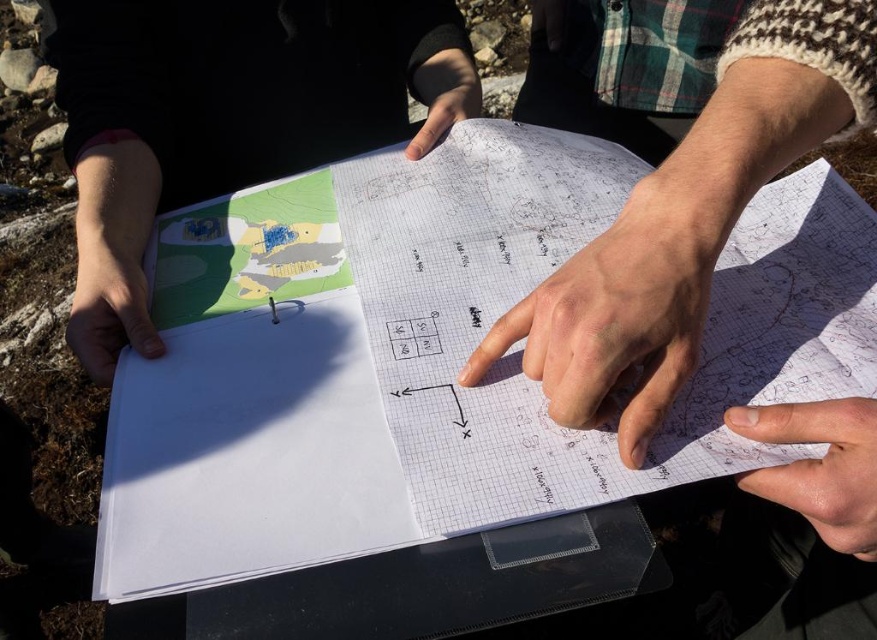
You are an architect reviewing a project layout. You need to determine if the matte paper map at upper left can be placed on a shelf designed for items no wider than the matte white paper at lower left. Can it fit?

The matte paper map at upper left might be wider than the matte white paper at lower left, so it may not fit on the shelf designed for items no wider than the matte white paper at lower left.

You are a field researcher who needs to compare the two papers. You have a magnifying glass that can only focus on objects closer to you. Which paper should you use it on, the matte paper map at upper left or the matte white paper at lower left?

The matte paper map at upper left is closer to the viewer than the matte white paper at lower left, so you should use the magnifying glass on the matte paper map at upper left.

You are a delivery person who needs to place a 18 inch long package on the table between the matte paper map at upper left and the smooth skin hand at lower right. Can the package fit in that space?

The matte paper map at upper left and smooth skin hand at lower right are 20.29 inches apart, so yes, the 18 inch long package can fit in the space between them.